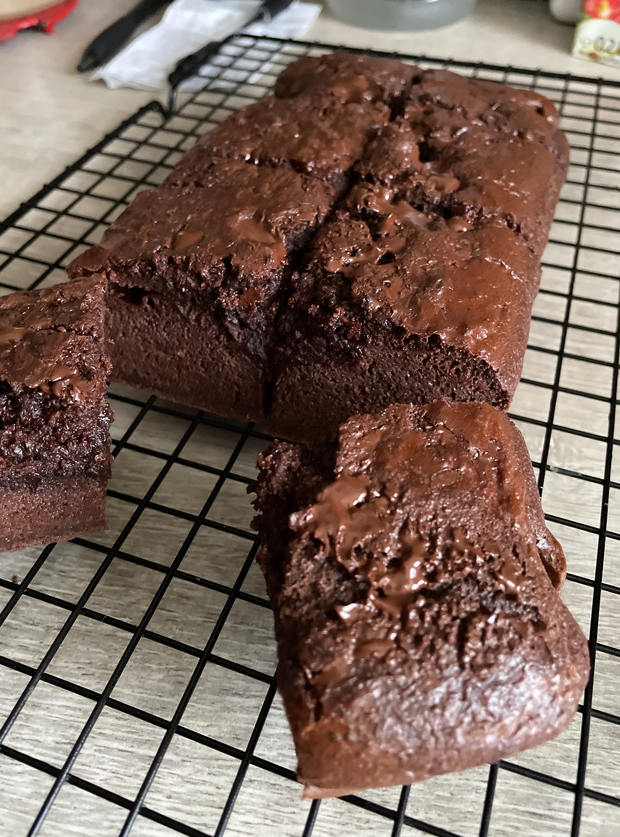
This screenshot has width=620, height=837. I want to click on wood table, so click(16, 63), click(38, 116).